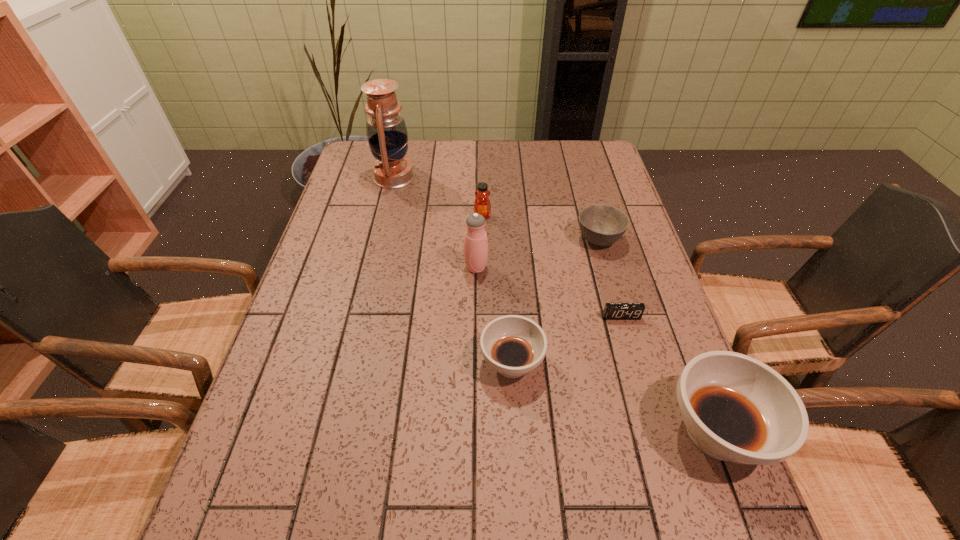
Identify the location of the shorter soup bowl. (513, 345).

I want to click on the taller soup bowl, so click(735, 408).

This screenshot has width=960, height=540. Identify the location of honey. (482, 205).

The height and width of the screenshot is (540, 960). Identify the location of the sixth nearest object. (482, 205).

Locate an element on the screen. The height and width of the screenshot is (540, 960). bowl is located at coordinates (601, 225).

You are a GUI agent. You are given a task and a screenshot of the screen. Output one action in this format:
    pyautogui.click(x=<x>, y=<y>)
    Task: Click on the oil lamp
    Image resolution: width=960 pixels, height=540 pixels.
    Given the screenshot: What is the action you would take?
    pyautogui.click(x=386, y=130)

Find the location of a particular element. This screenshot has height=540, width=960. the tallest object is located at coordinates (386, 130).

What are the coordinates of `the third nearest object` in the screenshot? It's located at (612, 311).

Locate an element on the screen. The height and width of the screenshot is (540, 960). the shortest object is located at coordinates (612, 311).

What are the coordinates of `the second tallest object` in the screenshot? It's located at (475, 242).